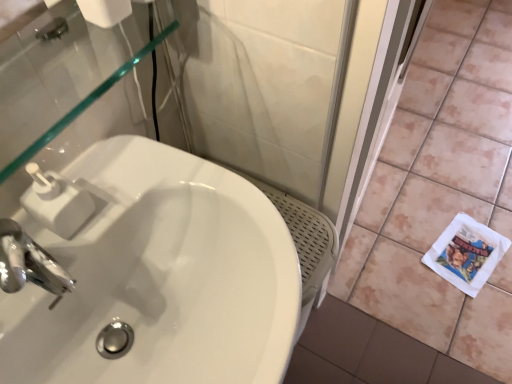
Measure the distance between point [362,245] and camera.

Point [362,245] is 5.29 feet from camera.

At what (x,y) coordinates should I click in order to perform the action: click on white glossy sink at center. Please return your answer as a coordinate pair (x, y). This screenshot has width=512, height=384. Looking at the image, I should click on (160, 277).

The image size is (512, 384). What do you see at coordinates (160, 277) in the screenshot?
I see `white glossy sink at center` at bounding box center [160, 277].

You are a GUI agent. You are given a task and a screenshot of the screen. Output one action in this format:
    pyautogui.click(x=<x>, y=<y>)
    Task: Click on the white matte toilet paper at upper left
    The height and width of the screenshot is (384, 512).
    Given the screenshot: What is the action you would take?
    pyautogui.click(x=105, y=11)

Is white ceramic tile at lower right oriented towards white glossy sink at center?

No, white ceramic tile at lower right is not oriented towards white glossy sink at center.

Is white ceramic tile at lower right bigger or smaller than white glossy sink at center?

white ceramic tile at lower right is bigger than white glossy sink at center.

Is white ceramic tile at lower right closer to the viewer compared to white glossy sink at center?

No.

I want to click on sink in front of the white ceramic tile at lower right, so click(x=160, y=277).

Does white glossy sink at center come behind white plastic soap dispenser at upper left?

No, it is in front of white plastic soap dispenser at upper left.

Does point (183, 210) come behind point (74, 231)?

Yes, it is.

Can you tell me how much white glossy sink at center and white plastic soap dispenser at upper left differ in facing direction?

0.000592 degrees.

Is the position of white glossy sink at center more distant than that of transparent glass mirror at upper left?

No, white glossy sink at center is closer to the viewer.

From the image's perspective, who appears lower, white glossy sink at center or transparent glass mirror at upper left?

white glossy sink at center is shown below in the image.

Is white glossy sink at center positioned with its back to transparent glass mirror at upper left?

white glossy sink at center does not have its back to transparent glass mirror at upper left.

Is point (190, 352) positioned after point (177, 26)?

No.

Is white matte toilet paper at upper left aimed at transparent glass mirror at upper left?

No, white matte toilet paper at upper left is not aimed at transparent glass mirror at upper left.

Is white matte toilet paper at upper left closer to the viewer compared to transparent glass mirror at upper left?

No, it is behind transparent glass mirror at upper left.

Can you tell me how much white matte toilet paper at upper left and transparent glass mirror at upper left differ in facing direction?

0.00111 degrees separate the facing orientations of white matte toilet paper at upper left and transparent glass mirror at upper left.

Consider the image. Which of these two, white matte toilet paper at upper left or transparent glass mirror at upper left, stands shorter?

transparent glass mirror at upper left.

From the image's perspective, which object appears higher, white paper at lower right or white glossy sink at center?

From the image's view, white glossy sink at center is above.

Which of these two, white paper at lower right or white glossy sink at center, is wider?

Wider between the two is white glossy sink at center.

Is point (453, 234) farther from viewer compared to point (184, 263)?

Yes, point (453, 234) is behind point (184, 263).

This screenshot has width=512, height=384. I want to click on sink above the white paper at lower right (from a real-world perspective), so click(160, 277).

How many degrees apart are the facing directions of white plastic soap dispenser at upper left and white matte toilet paper at upper left?

The angle between the facing direction of white plastic soap dispenser at upper left and the facing direction of white matte toilet paper at upper left is 0.739 degrees.

From a real-world perspective, who is located higher, white plastic soap dispenser at upper left or white matte toilet paper at upper left?

white matte toilet paper at upper left is physically above.

In the image, is white plastic soap dispenser at upper left on the left side or the right side of white matte toilet paper at upper left?

In the image, white plastic soap dispenser at upper left appears on the left side of white matte toilet paper at upper left.

Is white plastic soap dispenser at upper left oriented away from white matte toilet paper at upper left?

No, white plastic soap dispenser at upper left is not facing away from white matte toilet paper at upper left.

Is white matte toilet paper at upper left smaller than white glossy sink at center?

Yes, white matte toilet paper at upper left is smaller than white glossy sink at center.

Is white matte toilet paper at upper left to the right of white glossy sink at center from the viewer's perspective?

No, white matte toilet paper at upper left is not to the right of white glossy sink at center.

Does white matte toilet paper at upper left turn towards white glossy sink at center?

No.

From a real-world perspective, which is physically above, white matte toilet paper at upper left or white glossy sink at center?

white matte toilet paper at upper left.

This screenshot has height=384, width=512. I want to click on ceramic tile to the right of white glossy sink at center, so click(442, 189).

The height and width of the screenshot is (384, 512). I want to click on sink below the white plastic soap dispenser at upper left (from the image's perspective), so click(160, 277).

Which object lies further to the anchor point transparent glass mirror at upper left, white paper at lower right or white plastic soap dispenser at upper left?

Among the two, white paper at lower right is located further to transparent glass mirror at upper left.

Based on their spatial positions, is white plastic soap dispenser at upper left or white ceramic tile at lower right closer to white matte toilet paper at upper left?

Among the two, white plastic soap dispenser at upper left is located nearer to white matte toilet paper at upper left.

Which object lies further to the anchor point white matte toilet paper at upper left, white glossy sink at center or transparent glass mirror at upper left?

Among the two, white glossy sink at center is located further to white matte toilet paper at upper left.

When comparing their distances from transparent glass mirror at upper left, does white matte toilet paper at upper left or white paper at lower right seem closer?

Among the two, white matte toilet paper at upper left is located nearer to transparent glass mirror at upper left.

Based on their spatial positions, is white matte toilet paper at upper left or white paper at lower right further from white plastic soap dispenser at upper left?

white paper at lower right is positioned further to the anchor white plastic soap dispenser at upper left.

Which object lies further to the anchor point white glossy sink at center, white ceramic tile at lower right or white paper at lower right?

white paper at lower right is further to white glossy sink at center.

Considering their positions, is white matte toilet paper at upper left positioned further to transparent glass mirror at upper left than white ceramic tile at lower right?

Based on the image, white ceramic tile at lower right appears to be further to transparent glass mirror at upper left.

Which object lies nearer to the anchor point white paper at lower right, white glossy sink at center or transparent glass mirror at upper left?

white glossy sink at center lies closer to white paper at lower right than the other object.

This screenshot has height=384, width=512. In order to click on mirror between white plastic soap dispenser at upper left and white ceramic tile at lower right from left to right in this screenshot , I will do `click(83, 105)`.

I want to click on mirror between white matte toilet paper at upper left and white plastic soap dispenser at upper left vertically, so [83, 105].

Find the location of a particular element. The height and width of the screenshot is (384, 512). sink between transparent glass mirror at upper left and white paper at lower right is located at coordinates (160, 277).

Find the location of a particular element. The width and height of the screenshot is (512, 384). paper situated between transparent glass mirror at upper left and white ceramic tile at lower right from left to right is located at coordinates (466, 253).